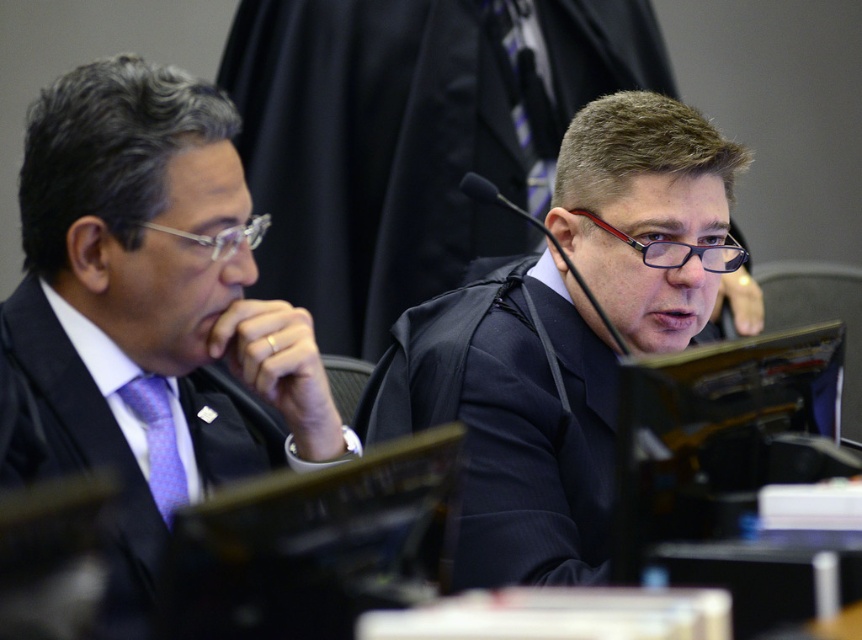
Question: Which object is positioned closest to the black fabric judge at center?

Choices:
 (A) matte black suit at left
 (B) purple textured tie at left

Answer: (A)

Question: Is black fabric judge at center positioned before purple textured tie at left?

Choices:
 (A) no
 (B) yes

Answer: (A)

Question: Does matte black suit at left appear on the left side of black fabric judge at center?

Choices:
 (A) yes
 (B) no

Answer: (A)

Question: Is matte black suit at left thinner than purple textured tie at left?

Choices:
 (A) no
 (B) yes

Answer: (A)

Question: Which object is the closest to the matte black suit at left?

Choices:
 (A) purple textured tie at left
 (B) black fabric judge at center

Answer: (A)

Question: Considering the real-world distances, which object is farthest from the purple textured tie at left?

Choices:
 (A) black fabric judge at center
 (B) matte black suit at left

Answer: (A)